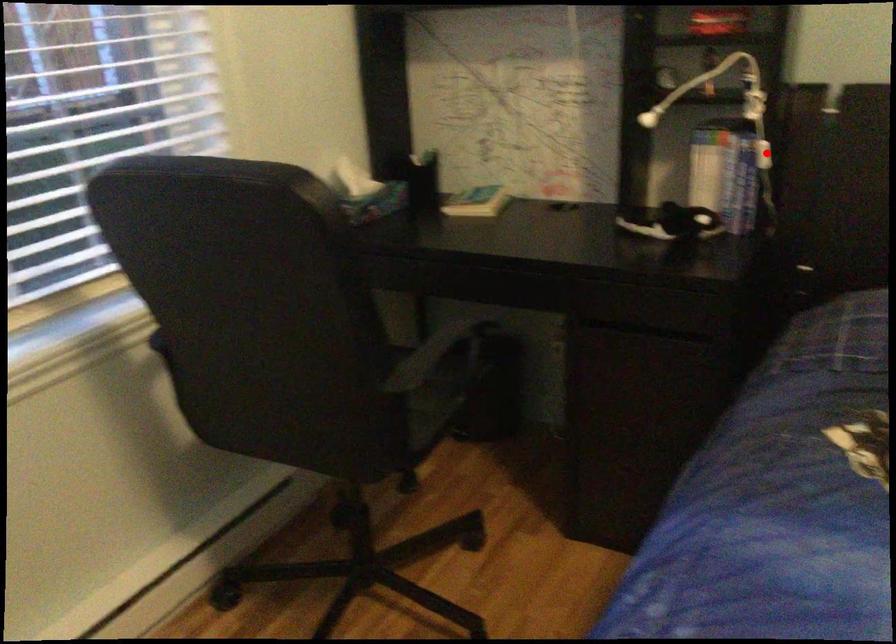
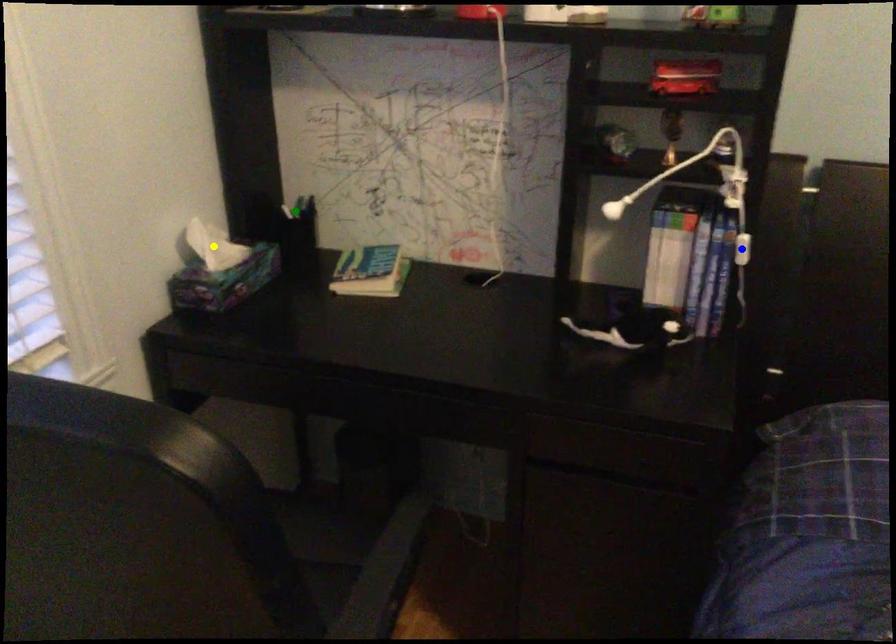
Question: I am providing you with two images of the same scene from different viewpoints. A red point is marked on the first image. You are given multiple points on the second image. Which spot in image 2 lines up with the point in image 1?

Choices:
 (A) yellow point
 (B) blue point
 (C) green point

Answer: (B)